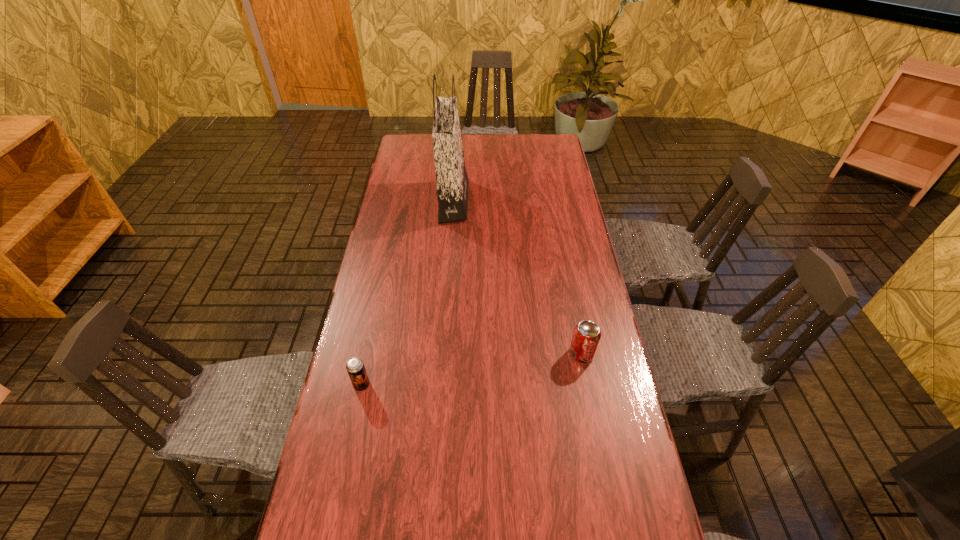
Locate an element on the screen. Image resolution: width=960 pixels, height=540 pixels. object that is at the right edge is located at coordinates (586, 336).

Where is `blank space at the far edge of the desktop`? blank space at the far edge of the desktop is located at coordinates (521, 160).

This screenshot has height=540, width=960. In the image, there is a desktop. In order to click on vacant space at the left edge in this screenshot , I will do `click(382, 355)`.

In order to click on free space at the right edge of the desktop in this screenshot , I will do `click(585, 299)`.

You are a GUI agent. You are given a task and a screenshot of the screen. Output one action in this format:
    pyautogui.click(x=<x>, y=<y>)
    Task: Click on the vacant space at the far right corner
    Image resolution: width=960 pixels, height=540 pixels.
    Given the screenshot: What is the action you would take?
    (549, 142)

What are the coordinates of `empty location between the second object from left to right and the soda can` in the screenshot? It's located at (517, 278).

The image size is (960, 540). What are the coordinates of `vacant area that lies between the soda can and the tallest object` in the screenshot? It's located at (517, 278).

Identify the location of vacant region between the shopping bag and the second farthest object. This screenshot has width=960, height=540. (517, 278).

This screenshot has width=960, height=540. Identify the location of vacant area between the nearest object and the shopping bag. (407, 293).

What are the coordinates of `free spot between the rightmost object and the leftmost object` in the screenshot? It's located at (471, 369).